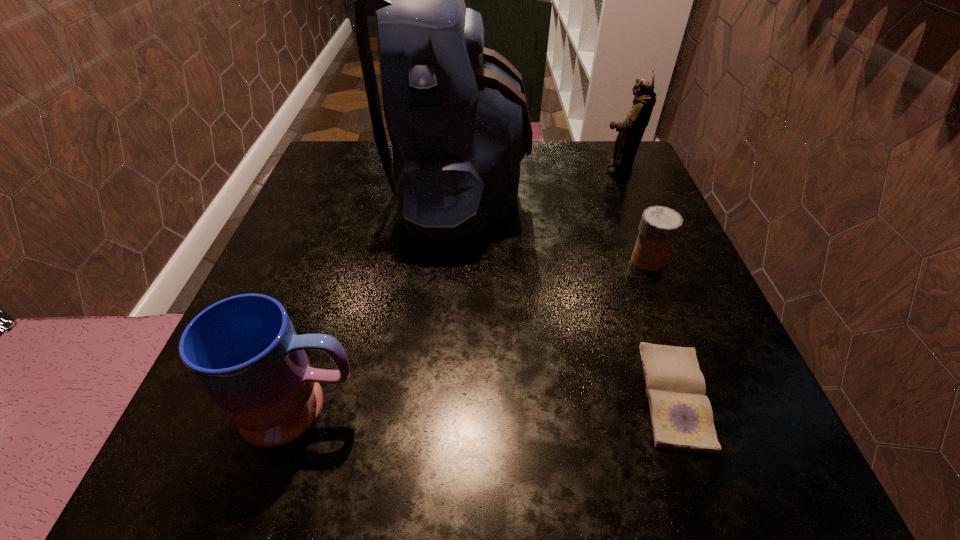
You are a GUI agent. You are given a task and a screenshot of the screen. Output one action in this format:
    pyautogui.click(x=<x>, y=<y>)
    Task: Click on the free spot located on the label side of the fourth tallest object
    The width and height of the screenshot is (960, 540).
    Given the screenshot: What is the action you would take?
    pyautogui.click(x=416, y=260)

Image resolution: width=960 pixels, height=540 pixels. Identify the location of blank space located on the label side of the fourth tallest object. (603, 260).

Where is `blank space located on the label side of the fourth tallest object`? Image resolution: width=960 pixels, height=540 pixels. blank space located on the label side of the fourth tallest object is located at coordinates (547, 260).

What are the coordinates of `vacant region located 0.220m on the back of the diary` in the screenshot? It's located at (624, 250).

Identify the location of backpack at the far edge. This screenshot has width=960, height=540. (457, 115).

Image resolution: width=960 pixels, height=540 pixels. Identify the location of figurine present at the far edge. (631, 130).

Where is `mug present at the near edge`? mug present at the near edge is located at coordinates (244, 351).

At what (x,y) coordinates should I click in order to perform the action: click on diary present at the near edge. Please return your answer as a coordinate pair (x, y). The height and width of the screenshot is (540, 960). Looking at the image, I should click on (681, 415).

This screenshot has height=540, width=960. I want to click on object located in the left edge section of the desktop, so click(x=244, y=351).

Locate an element on the screen. figurine positioned at the right edge is located at coordinates (631, 130).